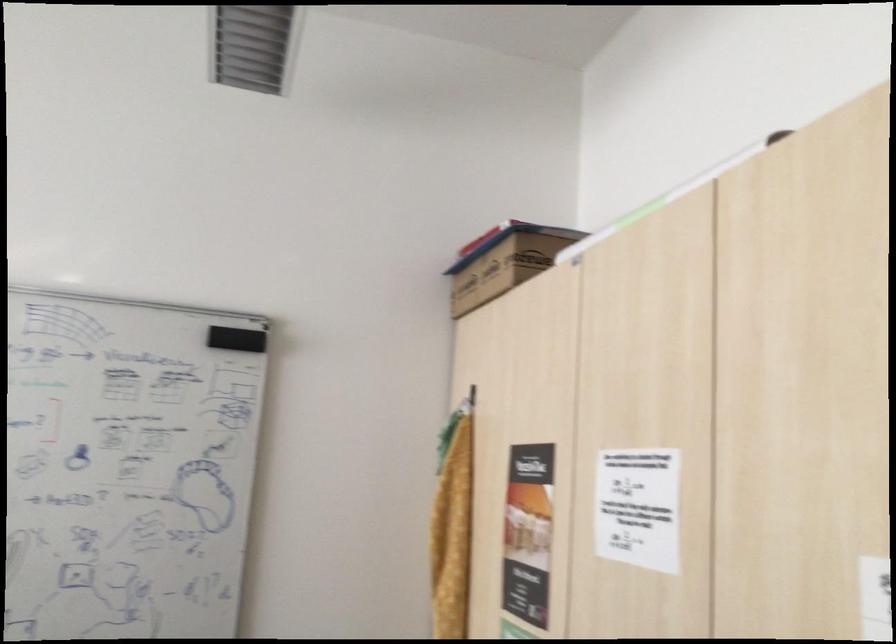
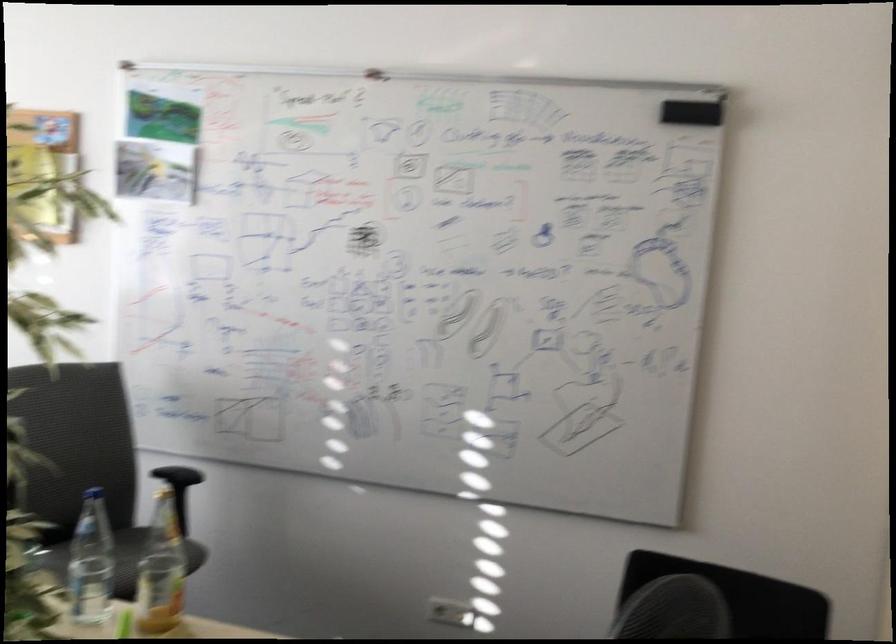
In the second image, find the point that corresponds to the point at 234,343 in the first image.

(692, 111)